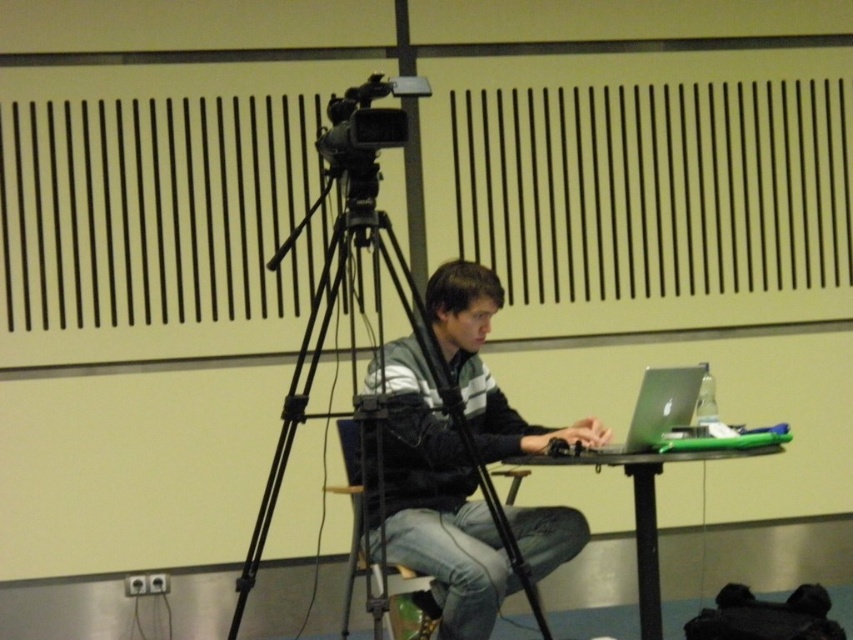
Question: Does denim at center come in front of black plastic video camera at upper center?

Choices:
 (A) no
 (B) yes

Answer: (A)

Question: Which object is farther from the camera taking this photo?

Choices:
 (A) matte black jacket at center
 (B) black plastic video camera at upper center
 (C) denim at center
 (D) green plastic table at center

Answer: (D)

Question: Does matte black jacket at center appear over green plastic table at center?

Choices:
 (A) no
 (B) yes

Answer: (B)

Question: Can you confirm if matte black jacket at center is smaller than silver metallic laptop at center?

Choices:
 (A) yes
 (B) no

Answer: (B)

Question: Which point is closer to the camera?

Choices:
 (A) black matte tripod at center
 (B) silver metallic laptop at center
 (C) matte black jacket at center

Answer: (A)

Question: Which point is farther to the camera?

Choices:
 (A) (645, 554)
 (B) (380, 81)
 (C) (413, 472)

Answer: (A)